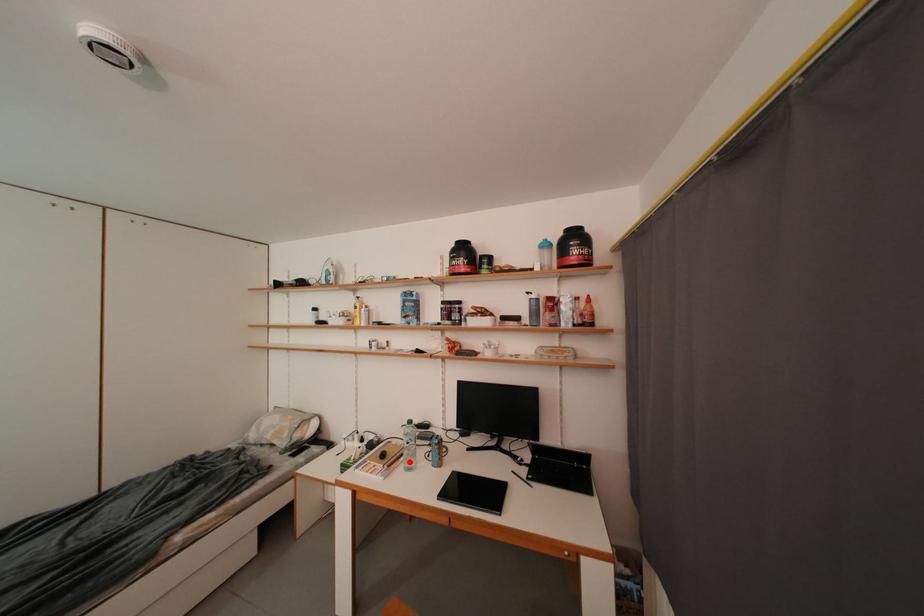
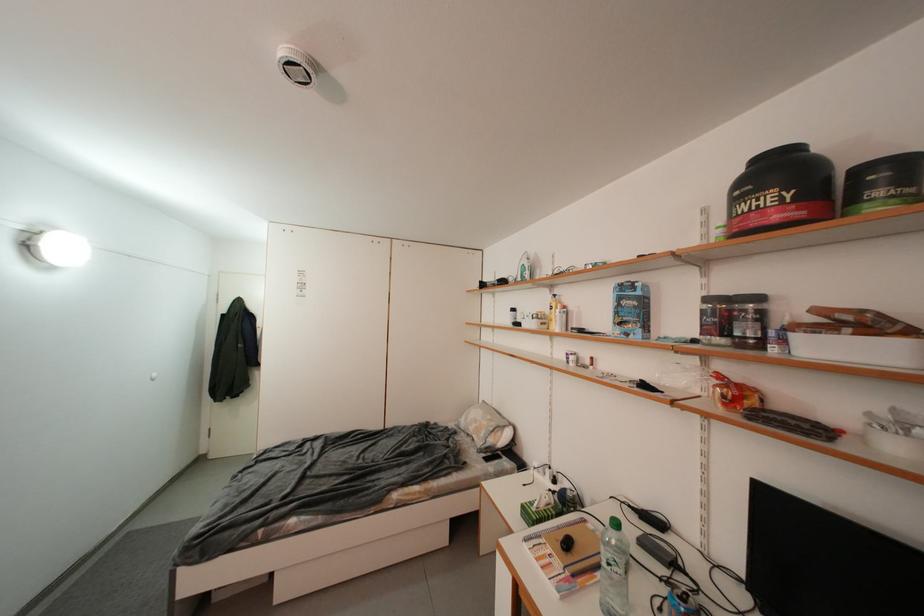
The point at the highlighted location is marked in the first image. Where is the corresponding point in the second image?

(606, 578)